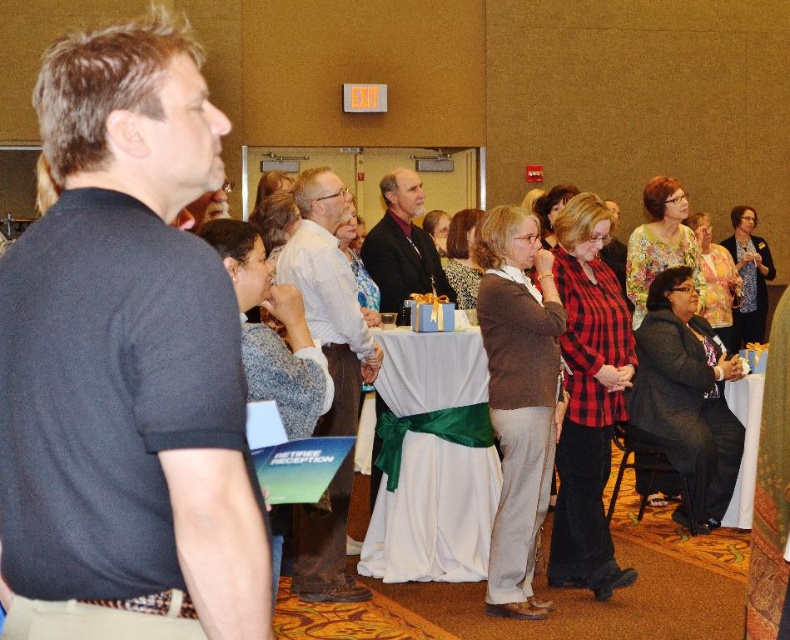
Question: Among these objects, which one is farthest from the camera?

Choices:
 (A) white satin table at center
 (B) dark brown leather jacket at center

Answer: (B)

Question: Is white shirt at center below dark brown leather jacket at center?

Choices:
 (A) yes
 (B) no

Answer: (A)

Question: Does white shirt at center appear under dark brown leather jacket at center?

Choices:
 (A) yes
 (B) no

Answer: (A)

Question: Which of the following is the closest to the observer?

Choices:
 (A) (111, 452)
 (B) (378, 413)

Answer: (A)

Question: Is dark blue t-shirt at left in front of white satin table at center?

Choices:
 (A) yes
 (B) no

Answer: (A)

Question: Estimate the real-world distances between objects in this image. Which object is farther from the white satin table at lower right?

Choices:
 (A) dark blue t-shirt at left
 (B) dark brown leather jacket at center
 (C) white shirt at center

Answer: (A)